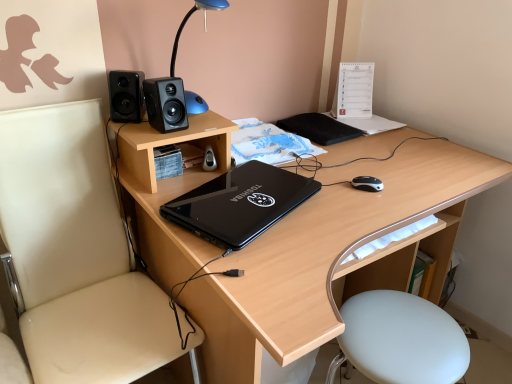
Where is `vacant point above white leather bar stool at lower right (from a real-world perspective)`? The height and width of the screenshot is (384, 512). vacant point above white leather bar stool at lower right (from a real-world perspective) is located at coordinates (399, 339).